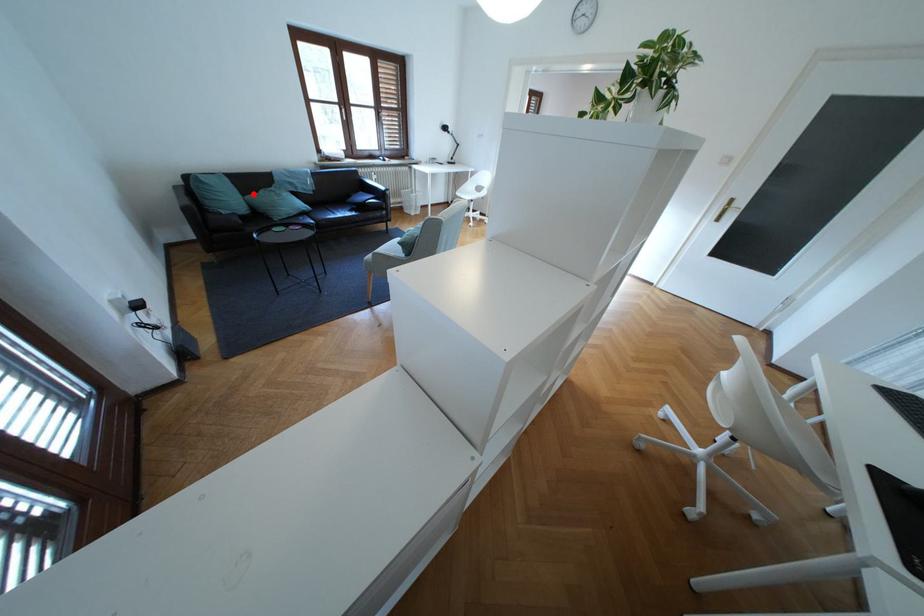
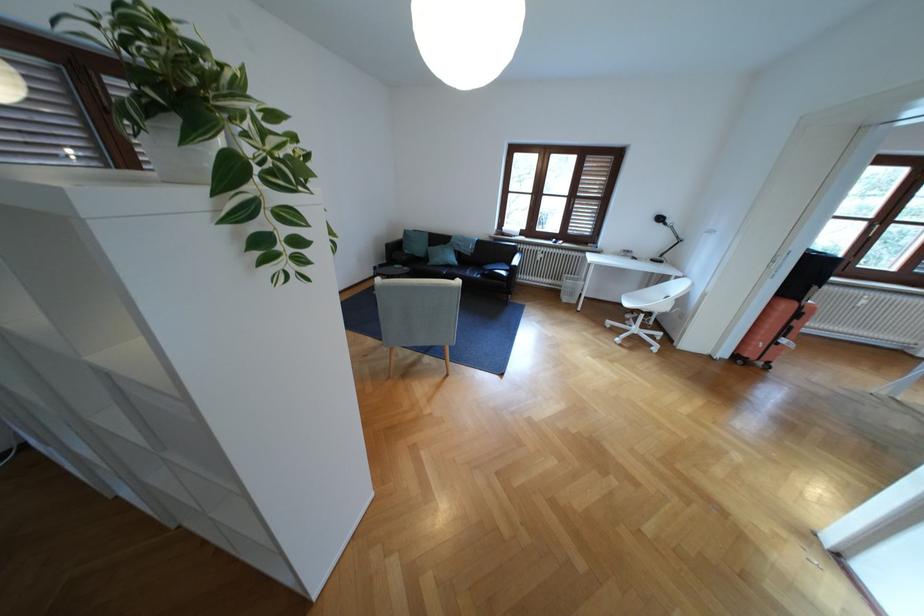
Question: I am providing you with two images of the same scene from different viewpoints. In image1, a red point is highlighted. Considering the same 3D point in image2, which of the following is correct?

Choices:
 (A) It is closer
 (B) It is farther

Answer: (A)